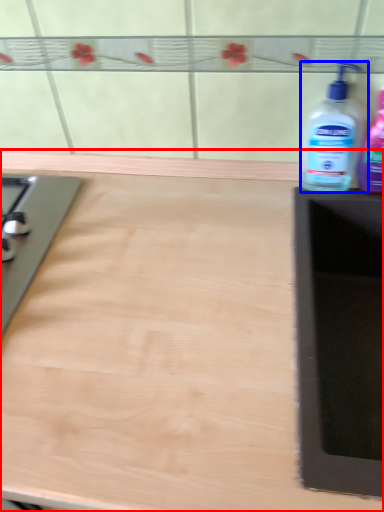
Question: Which of the following is the farthest to the observer, countertop (highlighted by a red box) or bottle (highlighted by a blue box)?

Choices:
 (A) countertop
 (B) bottle

Answer: (B)